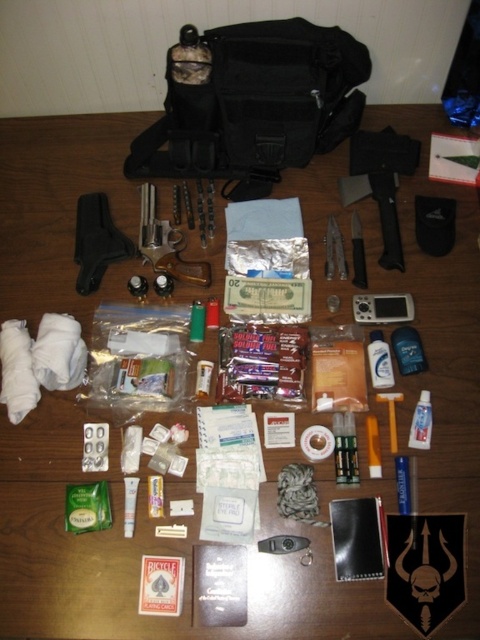
At what (x,y) coordinates should I click in order to perform the action: click on clear plastic razor at center. Please return your answer as a coordinate pair (x, y). This screenshot has width=480, height=640. Looking at the image, I should click on (380, 360).

Between clear plastic razor at center and white plastic razor at center, which one appears on the left side from the viewer's perspective?

clear plastic razor at center

Based on the photo, who is more distant from viewer, (388, 358) or (419, 428)?

The point (388, 358) is behind.

Locate an element on the screen. clear plastic razor at center is located at coordinates (380, 360).

Does black plastic gun at upper left have a smaller size compared to white plastic razor at center?

No.

Between point (113, 236) and point (412, 422), which one is positioned in front?

Positioned in front is point (412, 422).

The image size is (480, 640). Find the location of `black plastic gun at upper left`. black plastic gun at upper left is located at coordinates point(96,241).

Between wooden gun at center and white plastic razor at center, which one is positioned higher?

Positioned higher is wooden gun at center.

Locate an element on the screen. wooden gun at center is located at coordinates (166, 243).